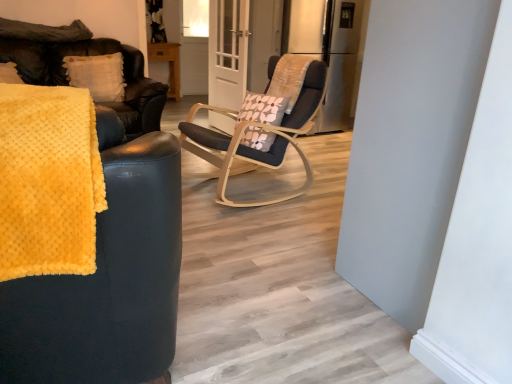
This screenshot has height=384, width=512. In order to click on metallic refrigerator at center in this screenshot , I will do `click(330, 50)`.

Where is `white textured pillow at upper left`? Image resolution: width=512 pixels, height=384 pixels. white textured pillow at upper left is located at coordinates [97, 75].

The image size is (512, 384). What do you see at coordinates (228, 52) in the screenshot? I see `clear glass door at center` at bounding box center [228, 52].

This screenshot has height=384, width=512. What do you see at coordinates (48, 181) in the screenshot?
I see `yellow fuzzy blanket at left` at bounding box center [48, 181].

At what (x,y) coordinates should I click in order to perform the action: click on metallic refrigerator at center. Please return your answer as a coordinate pair (x, y). This screenshot has height=384, width=512. Looking at the image, I should click on (330, 50).

How distant is white textured pillow at upper left from yellow fuzzy blanket at left?

white textured pillow at upper left is 2.86 meters away from yellow fuzzy blanket at left.

From the picture: From the image's perspective, is white textured pillow at upper left above or below yellow fuzzy blanket at left?

From the image's perspective, white textured pillow at upper left appears above yellow fuzzy blanket at left.

Is white textured pillow at upper left facing towards yellow fuzzy blanket at left?

Yes, white textured pillow at upper left is facing yellow fuzzy blanket at left.

What's the angular difference between clear glass door at center and yellow fuzzy blanket at left's facing directions?

105 degrees separate the facing orientations of clear glass door at center and yellow fuzzy blanket at left.

Between clear glass door at center and yellow fuzzy blanket at left, which one has smaller width?

With smaller width is clear glass door at center.

Between clear glass door at center and yellow fuzzy blanket at left, which one is positioned in front?

Positioned in front is yellow fuzzy blanket at left.

Which is nearer, (219, 98) or (92, 166)?

Point (219, 98) appears to be farther away from the viewer than point (92, 166).

From the image's perspective, which one is positioned lower, yellow fuzzy blanket at left or clear glass door at center?

From the image's view, yellow fuzzy blanket at left is below.

At what (x,y) coordinates should I click in order to perform the action: click on screen door behind the yellow fuzzy blanket at left. Please return your answer as a coordinate pair (x, y). Looking at the image, I should click on pos(228,52).

Is the position of yellow fuzzy blanket at left more distant than that of clear glass door at center?

No, yellow fuzzy blanket at left is in front of clear glass door at center.

From the image's perspective, is metallic refrigerator at center below clear glass door at center?

No, from the image's perspective, metallic refrigerator at center is not below clear glass door at center.

Is metallic refrigerator at center thinner than clear glass door at center?

Incorrect, the width of metallic refrigerator at center is not less than that of clear glass door at center.

Can you tell me how much metallic refrigerator at center and clear glass door at center differ in facing direction?

83.2 degrees.

Is metallic refrigerator at center turned away from clear glass door at center?

metallic refrigerator at center does not have its back to clear glass door at center.

Is yellow fuzzy blanket at left next to yellow fuzzy blanket at left and touching it?

No, yellow fuzzy blanket at left is not beside yellow fuzzy blanket at left.

From the image's perspective, which one is positioned lower, yellow fuzzy blanket at left or yellow fuzzy blanket at left?

yellow fuzzy blanket at left.

Does yellow fuzzy blanket at left have a greater width compared to yellow fuzzy blanket at left?

In fact, yellow fuzzy blanket at left might be narrower than yellow fuzzy blanket at left.

Is yellow fuzzy blanket at left inside or outside of yellow fuzzy blanket at left?

yellow fuzzy blanket at left exists entirely within yellow fuzzy blanket at left.

Can you confirm if yellow fuzzy blanket at left is thinner than metallic refrigerator at center?

In fact, yellow fuzzy blanket at left might be wider than metallic refrigerator at center.

Which is behind, yellow fuzzy blanket at left or metallic refrigerator at center?

metallic refrigerator at center is more distant.

Does yellow fuzzy blanket at left contain metallic refrigerator at center?

Actually, metallic refrigerator at center is outside yellow fuzzy blanket at left.

Does metallic refrigerator at center have a larger size compared to yellow fuzzy blanket at left?

Incorrect, metallic refrigerator at center is not larger than yellow fuzzy blanket at left.

From a real-world perspective, is metallic refrigerator at center physically below yellow fuzzy blanket at left?

Actually, metallic refrigerator at center is physically above yellow fuzzy blanket at left in the real world.

Is metallic refrigerator at center positioned beyond the bounds of yellow fuzzy blanket at left?

Absolutely, metallic refrigerator at center is external to yellow fuzzy blanket at left.

Is point (323, 128) positioned before point (90, 339)?

That is False.

In the image, there is a yellow fuzzy blanket at left. At what (x,y) coordinates should I click in order to perform the action: click on pillow above it (from the image's perspective). Please return your answer as a coordinate pair (x, y). The width and height of the screenshot is (512, 384). Looking at the image, I should click on (97, 75).

I want to click on screen door that is on the right side of yellow fuzzy blanket at left, so click(x=228, y=52).

Looking at the image, which one is located further to yellow fuzzy blanket at left, white textured pillow at upper left or clear glass door at center?

The object further to yellow fuzzy blanket at left is clear glass door at center.

Looking at the image, which one is located further to yellow fuzzy blanket at left, yellow fuzzy blanket at left or metallic refrigerator at center?

Based on the image, metallic refrigerator at center appears to be further to yellow fuzzy blanket at left.

Looking at the image, which one is located closer to yellow fuzzy blanket at left, clear glass door at center or metallic refrigerator at center?

The object closer to yellow fuzzy blanket at left is clear glass door at center.

Which object lies further to the anchor point metallic refrigerator at center, yellow fuzzy blanket at left or yellow fuzzy blanket at left?

yellow fuzzy blanket at left is further to metallic refrigerator at center.

Considering their positions, is yellow fuzzy blanket at left positioned closer to yellow fuzzy blanket at left than metallic refrigerator at center?

yellow fuzzy blanket at left.

Considering their positions, is metallic refrigerator at center positioned further to white textured pillow at upper left than yellow fuzzy blanket at left?

Among the two, yellow fuzzy blanket at left is located further to white textured pillow at upper left.

Looking at the image, which one is located closer to yellow fuzzy blanket at left, clear glass door at center or yellow fuzzy blanket at left?

Based on the image, yellow fuzzy blanket at left appears to be nearer to yellow fuzzy blanket at left.

When comparing their distances from clear glass door at center, does metallic refrigerator at center or yellow fuzzy blanket at left seem closer?

metallic refrigerator at center is positioned closer to the anchor clear glass door at center.

I want to click on blanket between yellow fuzzy blanket at left and metallic refrigerator at center along the z-axis, so click(48, 181).

This screenshot has width=512, height=384. In order to click on pillow between yellow fuzzy blanket at left and metallic refrigerator at center from front to back in this screenshot , I will do `click(97, 75)`.

The image size is (512, 384). I want to click on screen door between white textured pillow at upper left and metallic refrigerator at center from left to right, so click(x=228, y=52).

What are the coordinates of `pillow between yellow fuzzy blanket at left and clear glass door at center in the front-back direction` in the screenshot? It's located at (97, 75).